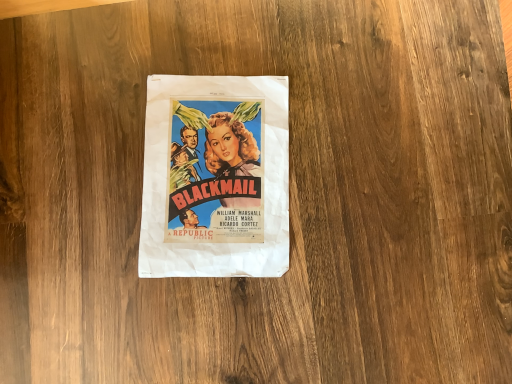
In order to click on vacant area on top of matte paper poster at center (from a real-world perspective) in this screenshot , I will do `click(217, 173)`.